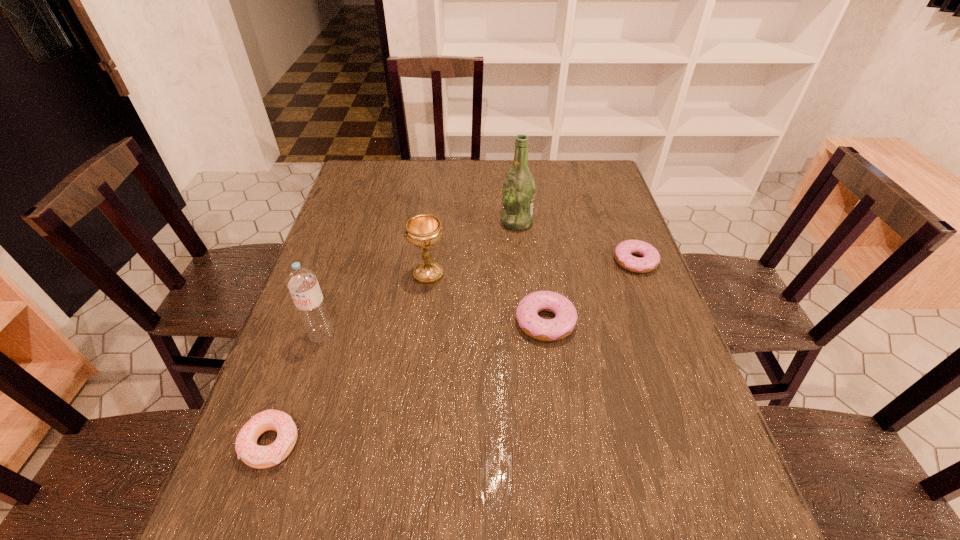
Find the location of a particular element. The width and height of the screenshot is (960, 540). vacant place for an extra doughnut on the left is located at coordinates (425, 402).